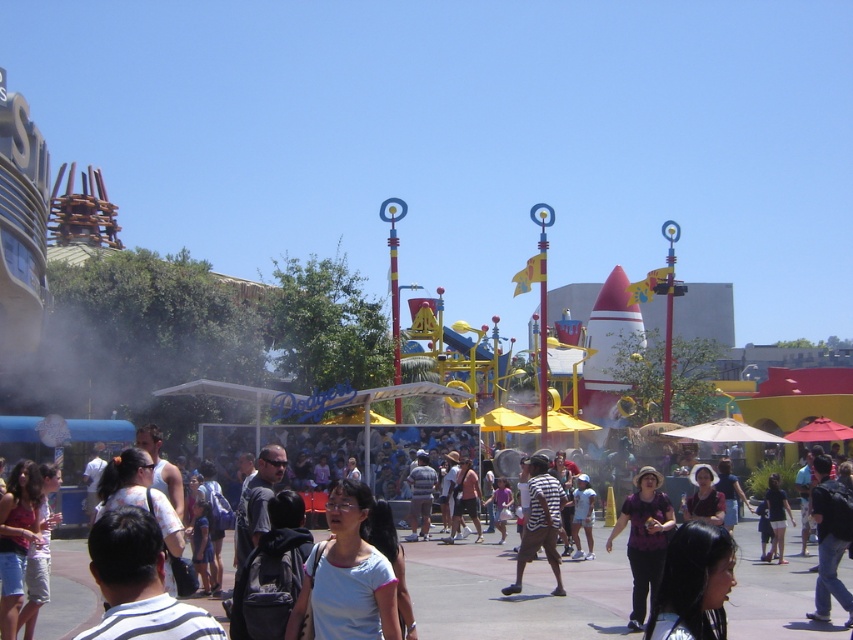
You are standing at the entrance of the theme park and see two points in the distance. The first point is at coordinates point (320, 616) and the second is at point (643, 586). Which point is nearer to you?

Point (320, 616) is closer to the viewer than point (643, 586).

In the scene shown: You are standing in the theme park and see two shirts in the crowd at the center. The white matte shirt at center and the striped fabric shirt at center. Which one is positioned more to the left?

The white matte shirt at center is positioned to the left of the striped fabric shirt at center, so the white matte shirt at center is more to the left.

You are a photographer trying to capture both the white matte shirt at center and the striped fabric shirt at center in the same frame. Based on their sizes, which one would appear closer to the camera?

The white matte shirt at center appears closer to the camera because it has a smaller size compared to the striped fabric shirt at center.